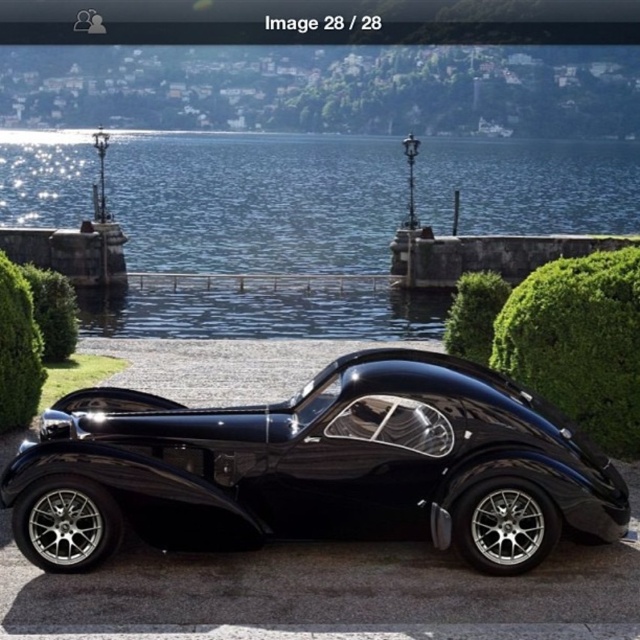
Can you confirm if shiny black sports car at center is positioned above clear blue water at center?

No.

Can you confirm if shiny black sports car at center is smaller than clear blue water at center?

Yes, shiny black sports car at center is smaller than clear blue water at center.

Does point (353, 426) come closer to viewer compared to point (396, 163)?

Yes, it is.

I want to click on shiny black sports car at center, so click(316, 465).